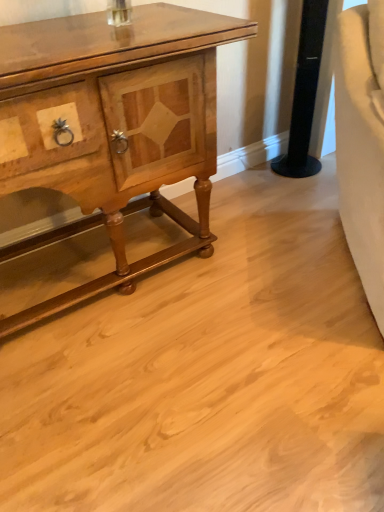
This screenshot has height=512, width=384. Find the location of `vacant space underneath black glossy speaker at upper right (from a real-world perspective)`. vacant space underneath black glossy speaker at upper right (from a real-world perspective) is located at coordinates (297, 170).